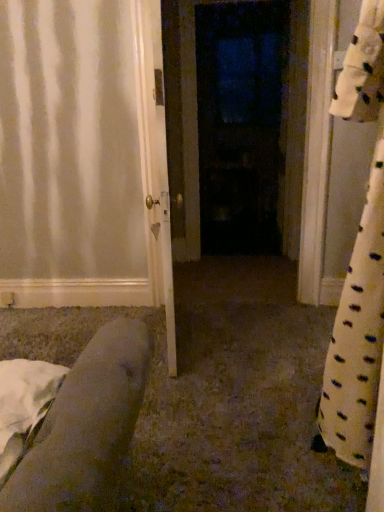
Question: Can you confirm if white glossy door at center, which is the first door from front to back, is bigger than dark matte door at center, placed as the first door when sorted from right to left?

Choices:
 (A) yes
 (B) no

Answer: (B)

Question: Could you tell me if white glossy door at center, arranged as the 2th door when viewed from the back, is facing dark matte door at center, which appears as the 2th door when viewed from the left?

Choices:
 (A) no
 (B) yes

Answer: (A)

Question: From the image's perspective, is white glossy door at center, arranged as the 2th door when viewed from the back, located beneath dark matte door at center, acting as the 1th door starting from the back?

Choices:
 (A) yes
 (B) no

Answer: (A)

Question: From a real-world perspective, is white glossy door at center, arranged as the 2th door when viewed from the back, under dark matte door at center, marked as the second door in a front-to-back arrangement?

Choices:
 (A) no
 (B) yes

Answer: (B)

Question: Can you confirm if white glossy door at center, the 2th door viewed from the right, is positioned to the left of dark matte door at center, which appears as the 2th door when viewed from the left?

Choices:
 (A) no
 (B) yes

Answer: (B)

Question: Would you say white glossy door at center, which is the first door from front to back, is a long distance from dark matte door at center, placed as the first door when sorted from right to left?

Choices:
 (A) no
 (B) yes

Answer: (B)

Question: From a real-world perspective, is dark matte door at center, placed as the first door when sorted from right to left, physically above white glossy door at center, the 1th door when ordered from left to right?

Choices:
 (A) yes
 (B) no

Answer: (A)

Question: Is dark matte door at center, marked as the second door in a front-to-back arrangement, not close to white glossy door at center, the 2th door viewed from the right?

Choices:
 (A) yes
 (B) no

Answer: (A)

Question: Is dark matte door at center, acting as the 1th door starting from the back, turned away from white glossy door at center, the 1th door when ordered from left to right?

Choices:
 (A) yes
 (B) no

Answer: (B)

Question: Does dark matte door at center, marked as the second door in a front-to-back arrangement, come behind white glossy door at center, which is the first door from front to back?

Choices:
 (A) no
 (B) yes

Answer: (B)

Question: Does dark matte door at center, acting as the 1th door starting from the back, lie in front of white glossy door at center, which is the first door from front to back?

Choices:
 (A) yes
 (B) no

Answer: (B)

Question: Can you confirm if dark matte door at center, placed as the first door when sorted from right to left, is wider than white glossy door at center, the 2th door viewed from the right?

Choices:
 (A) no
 (B) yes

Answer: (B)

Question: Is dark matte door at center, which appears as the 2th door when viewed from the left, in front of or behind white glossy door at center, arranged as the 2th door when viewed from the back, in the image?

Choices:
 (A) front
 (B) behind

Answer: (B)